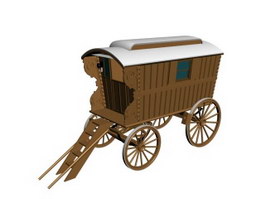
Find the location of a particular element. This screenshot has width=265, height=199. window is located at coordinates (183, 67).